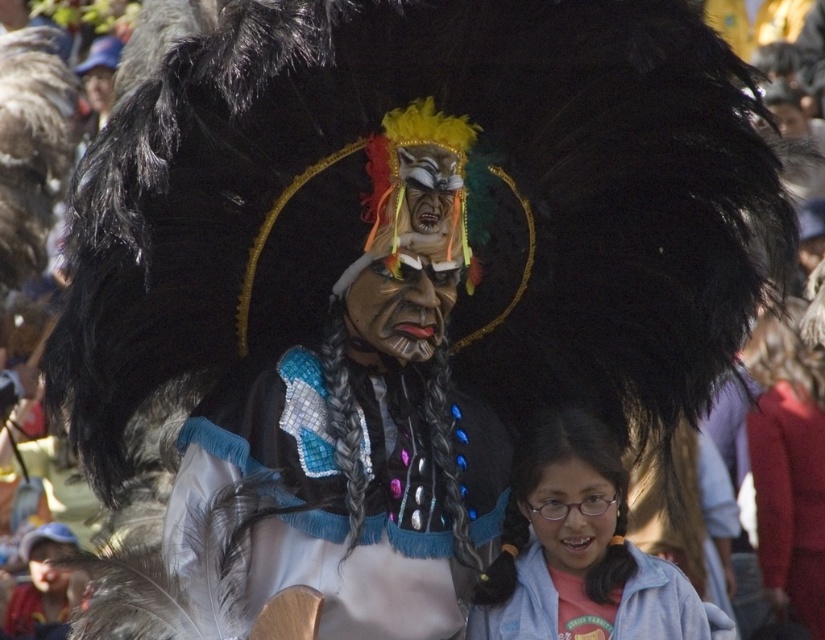
Is matte red jacket at lower right bigger than pink fabric at lower center?

Correct, matte red jacket at lower right is larger in size than pink fabric at lower center.

Who is shorter, matte red jacket at lower right or pink fabric at lower center?

pink fabric at lower center

Is point (816, 362) farther from viewer compared to point (515, 625)?

That is True.

Where is `matte red jacket at lower right`? This screenshot has height=640, width=825. matte red jacket at lower right is located at coordinates (788, 465).

Can you confirm if pink fabric at lower right is positioned to the left of matte red jacket at lower right?

Yes, pink fabric at lower right is to the left of matte red jacket at lower right.

Who is shorter, pink fabric at lower right or matte red jacket at lower right?

Standing shorter between the two is pink fabric at lower right.

The width and height of the screenshot is (825, 640). What do you see at coordinates (580, 552) in the screenshot? I see `pink fabric at lower right` at bounding box center [580, 552].

In order to click on pink fabric at lower right in this screenshot , I will do `click(580, 552)`.

Who is taller, shiny silver feathers at center or pink fabric at lower center?

shiny silver feathers at center is taller.

Is shiny silver feathers at center in front of pink fabric at lower center?

That is True.

Image resolution: width=825 pixels, height=640 pixels. What do you see at coordinates (326, 500) in the screenshot? I see `shiny silver feathers at center` at bounding box center [326, 500].

Locate an element on the screen. The height and width of the screenshot is (640, 825). shiny silver feathers at center is located at coordinates (326, 500).